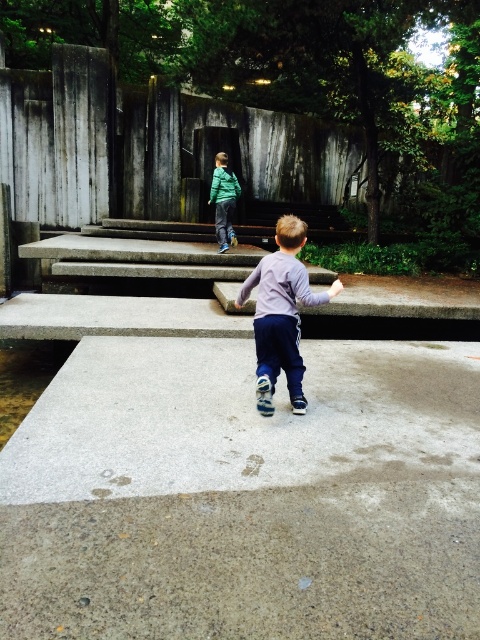
Question: Which object is positioned closest to the brown gravel at lower left?

Choices:
 (A) purple cotton pants at center
 (B) gray polished concrete at center
 (C) green matte jacket at upper center

Answer: (B)

Question: Is purple cotton pants at center smaller than green matte jacket at upper center?

Choices:
 (A) no
 (B) yes

Answer: (B)

Question: Can you confirm if brown gravel at lower left is bigger than green matte jacket at upper center?

Choices:
 (A) yes
 (B) no

Answer: (A)

Question: Which object is positioned farthest from the green matte jacket at upper center?

Choices:
 (A) brown gravel at lower left
 (B) gray polished concrete at center
 (C) purple cotton pants at center

Answer: (B)

Question: Which of the following is the closest to the observer?

Choices:
 (A) green matte jacket at upper center
 (B) gray polished concrete at center
 (C) brown gravel at lower left

Answer: (B)

Question: Does purple cotton pants at center come in front of green matte jacket at upper center?

Choices:
 (A) no
 (B) yes

Answer: (B)